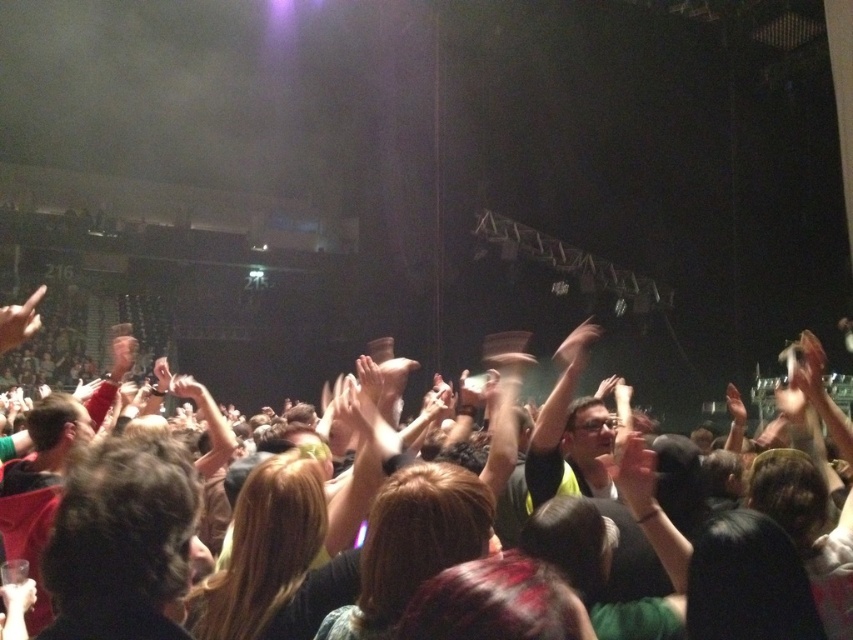
You are a photographer at the concert and want to capture both the matte black hand at center and the matte black hand at lower left in a single frame. Which hand should you focus on first if you need to adjust your camera settings for wider framing?

The matte black hand at center has a larger width than the matte black hand at lower left, so you should focus on the matte black hand at center first to ensure proper framing for its size.

You are a photographer at the concert and want to capture a closeup of the matte black hand at center. Given that your camera has a focal length of 50mm, which is suitable for portraits, would the point marked at coordinate (577, 342) be an appropriate focus point for your shot?

Yes, the point marked at coordinate (577, 342) corresponds to the matte black hand at center, making it an appropriate focus point for capturing a closeup with a 50mm lens.